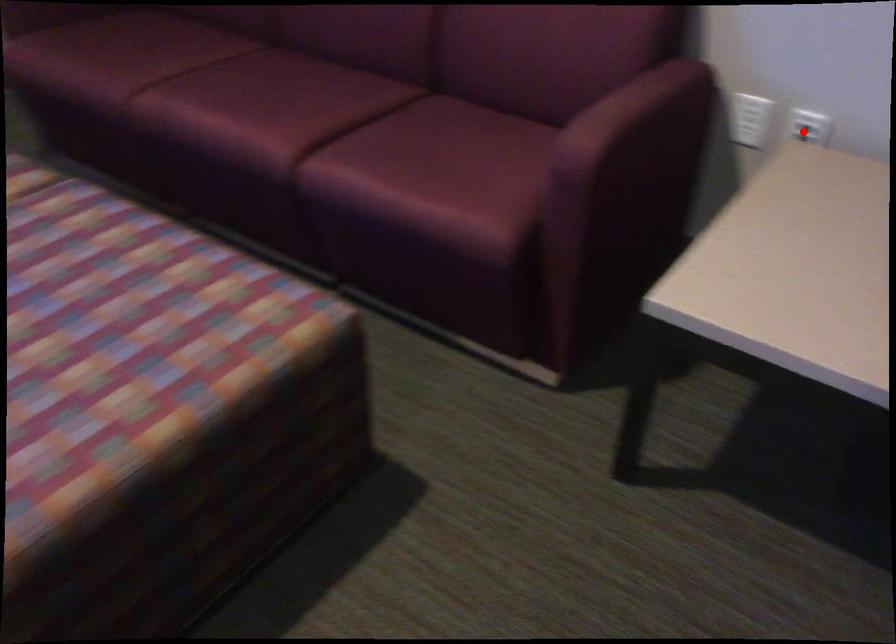
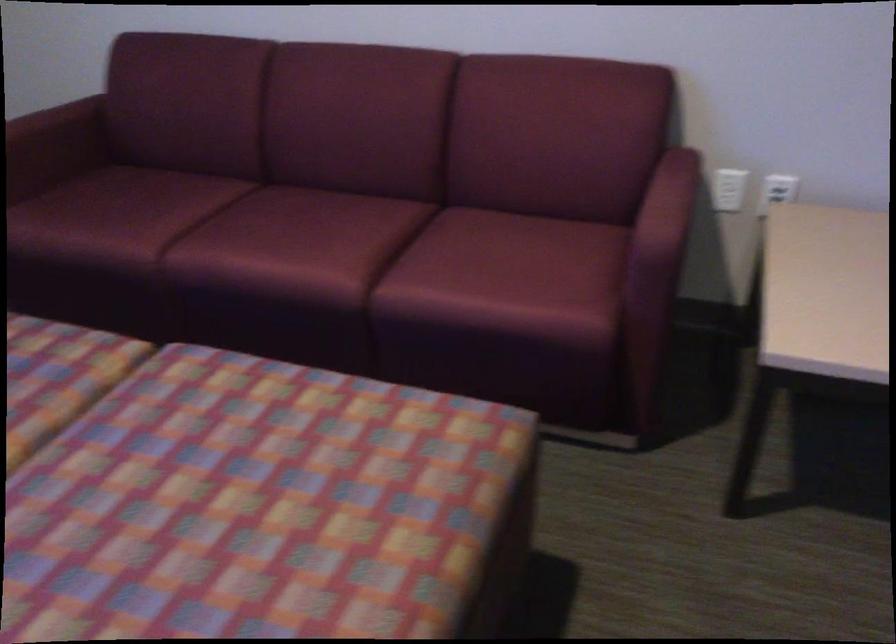
Question: I am providing you with two images of the same scene from different viewpoints. A red point is shown in image1. For the corresponding object point in image2, is it positioned nearer or farther from the camera?

Choices:
 (A) Nearer
 (B) Farther

Answer: (B)